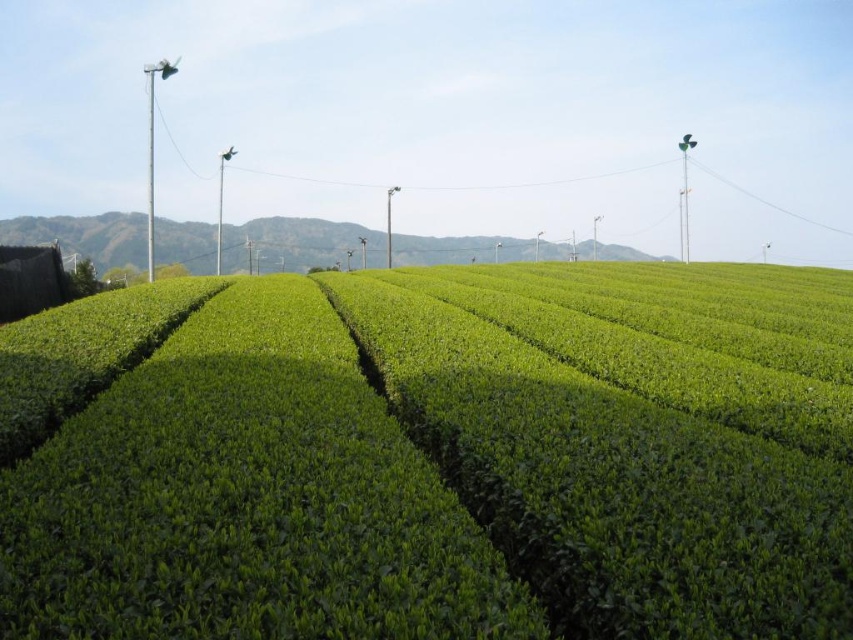
Question: Which point is farther to the camera?

Choices:
 (A) (479, 468)
 (B) (268, 232)

Answer: (B)

Question: Is green leafy field at center thinner than green grassy hill at center?

Choices:
 (A) no
 (B) yes

Answer: (B)

Question: Does green leafy field at center appear on the right side of green grassy hill at center?

Choices:
 (A) no
 (B) yes

Answer: (B)

Question: Can you confirm if green leafy field at center is bigger than green grassy hill at center?

Choices:
 (A) no
 (B) yes

Answer: (A)

Question: Which point is closer to the camera taking this photo?

Choices:
 (A) (735, 586)
 (B) (42, 220)

Answer: (A)